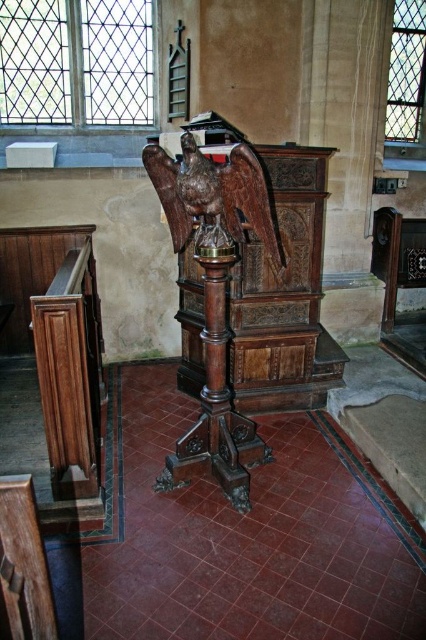
You are a visitor standing in the church and want to take a photo of the polished wood eagle at center. To avoid blocking the wooden chair at lower left in the shot, should you position yourself to the right or left of the eagle?

You should position yourself to the right of the polished wood eagle at center because it is on the right side of the wooden chair at lower left, so standing to the right of the eagle will keep the chair out of the frame.

You are an interior designer assessing the space in the church. You need to determine if the polished wood eagle at center and the wooden chair at lower left can both fit through a doorway that is 1.2 meters wide. Given their sizes, will they fit through the doorway together?

The polished wood eagle at center is bigger than the wooden chair at lower left. However, without specific measurements of their widths, it is impossible to determine if they can both fit through the 1.2 meter wide doorway. Additional information about their dimensions is required to make an accurate assessment.

You are standing in the church and want to take a closer look at both the polished wood eagle at center and the wooden chair at lower left. Which object will you need to walk towards first if you want to reach the one closer to you?

The polished wood eagle at center is closer to you than the wooden chair at lower left, so you should walk towards the polished wood eagle at center first.